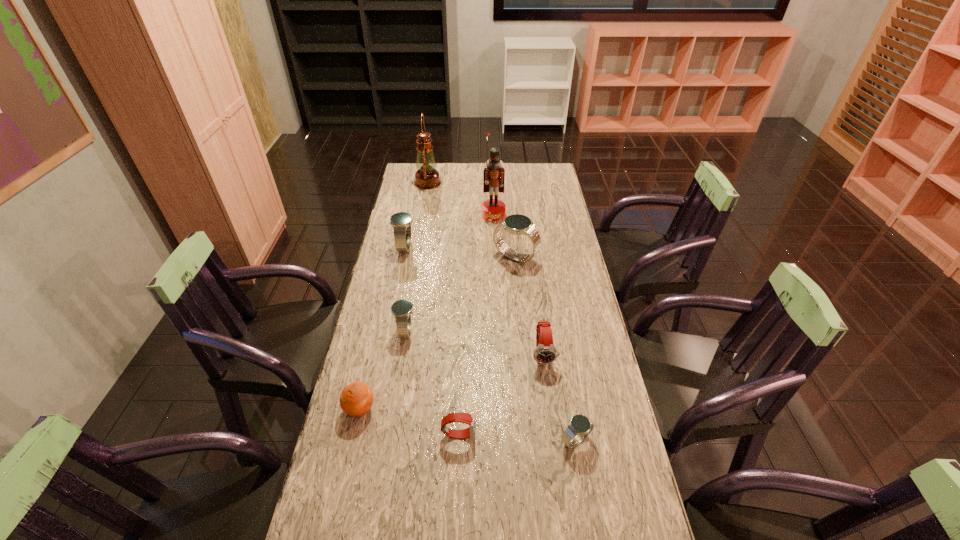
Where is `empty space between the farther red watch and the farthest object`? empty space between the farther red watch and the farthest object is located at coordinates (486, 268).

At what (x,y) coordinates should I click in order to perform the action: click on empty location between the third smallest blue watch and the oil lamp. Please return your answer as a coordinate pair (x, y). The image size is (960, 540). Looking at the image, I should click on (417, 215).

Where is `free space between the smallest blue watch and the second smallest blue watch`? free space between the smallest blue watch and the second smallest blue watch is located at coordinates (491, 386).

Where is `free point between the red nutcracker and the tallest watch`? The height and width of the screenshot is (540, 960). free point between the red nutcracker and the tallest watch is located at coordinates click(x=504, y=235).

Where is `free area in between the smaller red watch and the bigger red watch`? free area in between the smaller red watch and the bigger red watch is located at coordinates (501, 394).

Locate an element on the screen. Image resolution: width=960 pixels, height=540 pixels. vacant area between the seventh shortest object and the third biggest blue watch is located at coordinates (461, 294).

You are a GUI agent. You are given a task and a screenshot of the screen. Output one action in this format:
    pyautogui.click(x=<x>, y=<y>)
    Task: Click on the vacant area that lies between the farther red watch and the nutcracker
    This screenshot has height=540, width=960.
    Given the screenshot: What is the action you would take?
    pyautogui.click(x=518, y=284)

Image resolution: width=960 pixels, height=540 pixels. I want to click on unoccupied position between the orange and the nutcracker, so click(x=426, y=312).

I want to click on object that stands as the eighth closest to the second farthest object, so click(x=580, y=426).

Where is `object that stands as the closest to the right red watch`? object that stands as the closest to the right red watch is located at coordinates (580, 426).